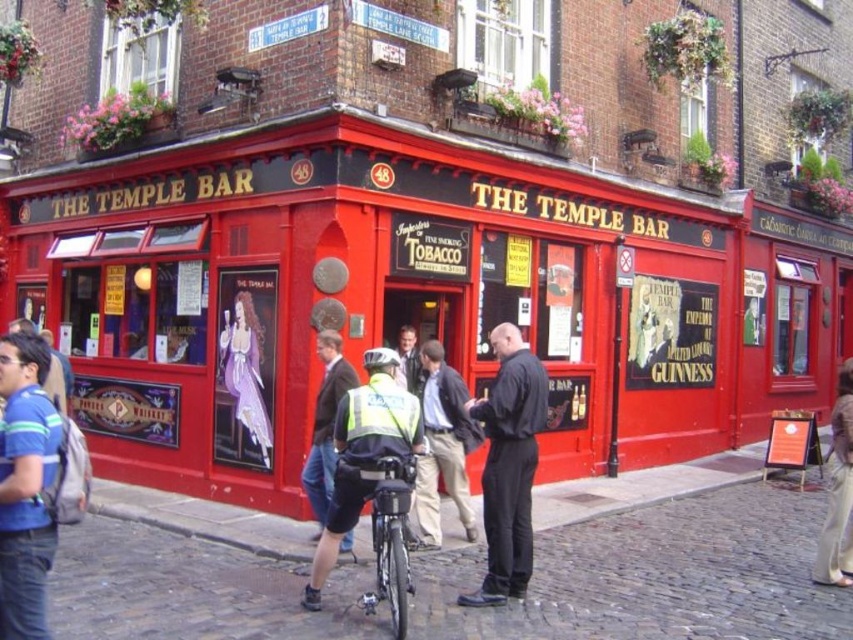
Consider the image. Is the position of matte red building at center less distant than that of blue striped shirt at lower left?

No, matte red building at center is further to the viewer.

Can you confirm if matte red building at center is positioned to the right of blue striped shirt at lower left?

Yes, matte red building at center is to the right of blue striped shirt at lower left.

The width and height of the screenshot is (853, 640). Find the location of `matte red building at center`. matte red building at center is located at coordinates (369, 291).

Locate an element on the screen. The image size is (853, 640). matte red building at center is located at coordinates (369, 291).

Does light beige pants at lower right have a lesser height compared to light brown leather jacket at center?

Correct, light beige pants at lower right is not as tall as light brown leather jacket at center.

Does light beige pants at lower right appear under light brown leather jacket at center?

Indeed, light beige pants at lower right is positioned under light brown leather jacket at center.

Is point (840, 534) less distant than point (399, 380)?

Yes, point (840, 534) is in front of point (399, 380).

This screenshot has width=853, height=640. I want to click on light beige pants at lower right, so click(838, 492).

From the picture: Is matte red building at center further to camera compared to shiny black bicycle at center?

Yes, matte red building at center is further from the viewer.

What do you see at coordinates (369, 291) in the screenshot?
I see `matte red building at center` at bounding box center [369, 291].

Where is `matte red building at center`? The height and width of the screenshot is (640, 853). matte red building at center is located at coordinates (369, 291).